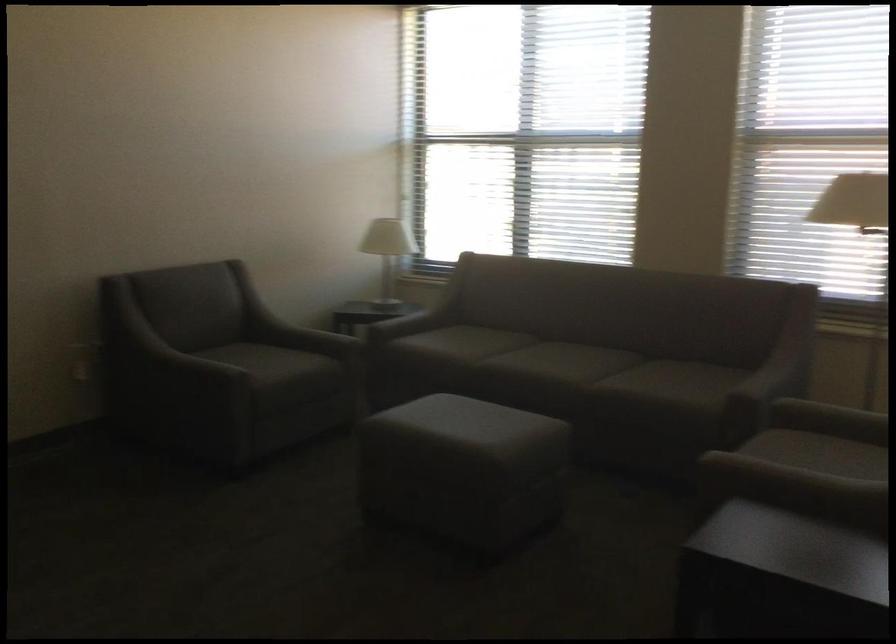
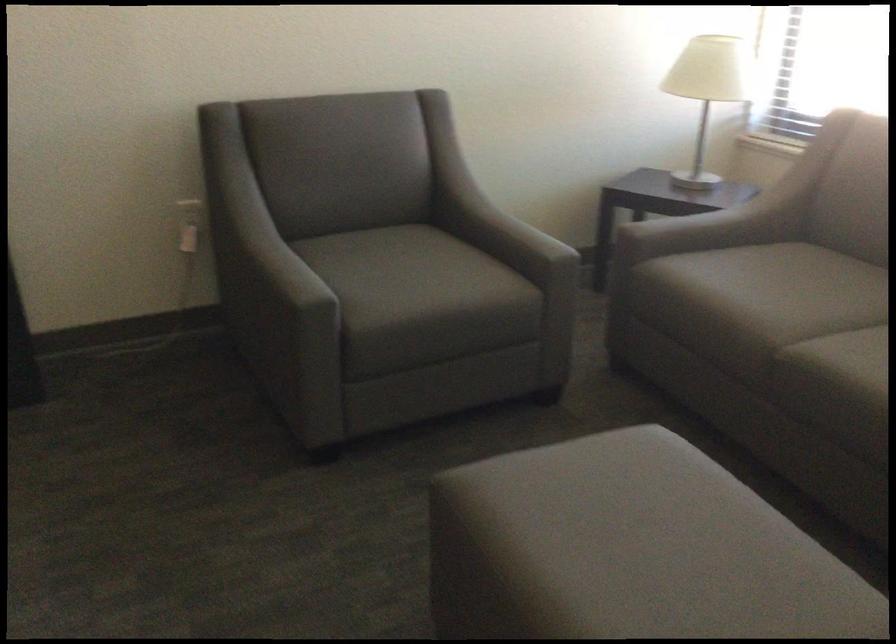
Where in the second image is the point corresponding to the point at 314,330 from the first image?

(509, 234)